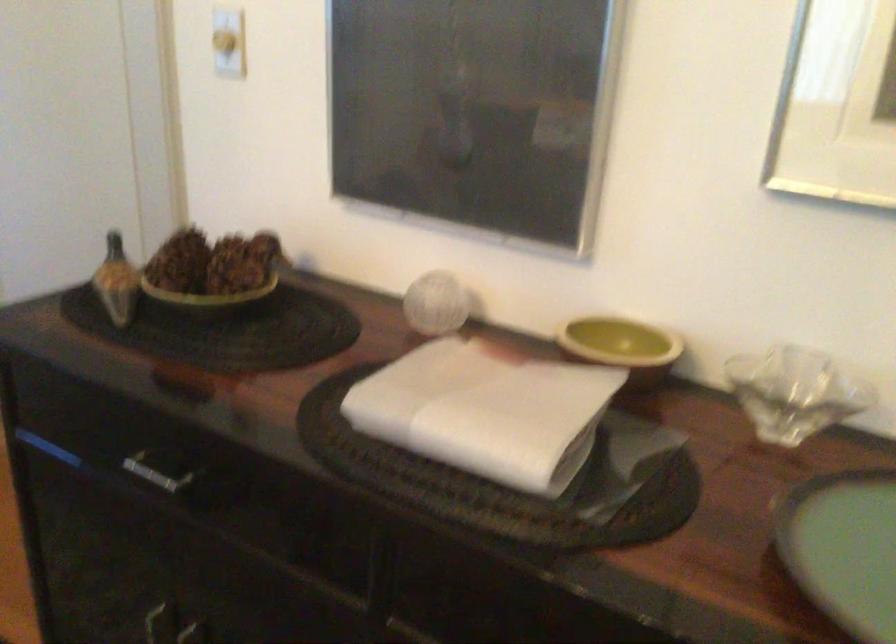
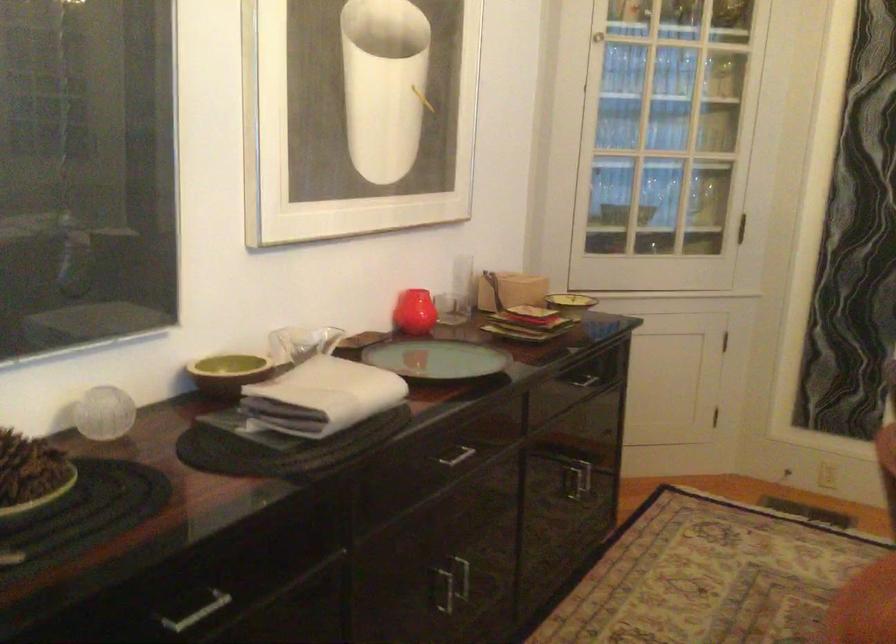
The point at [567,305] is marked in the first image. Where is the corresponding point in the second image?

(228, 373)